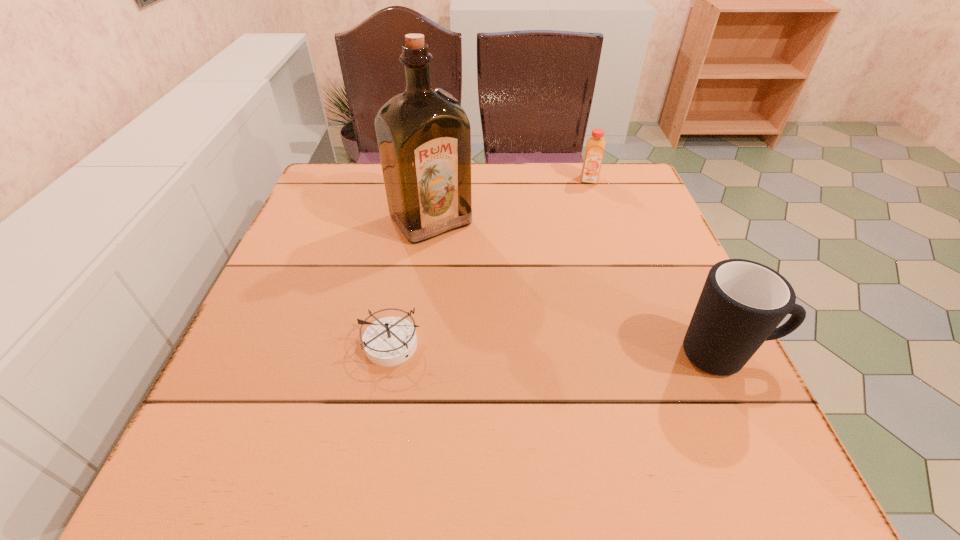
Image resolution: width=960 pixels, height=540 pixels. I want to click on vacant region located on the label of the liquor, so click(x=460, y=254).

Identify the location of vacant space situated 0.090m on the front and back of the farthest object. (590, 204).

In order to click on vacant region located on the front and back of the farthest object in this screenshot , I will do `click(593, 243)`.

This screenshot has height=540, width=960. I want to click on vacant area situated 0.050m on the front and back of the farthest object, so click(x=590, y=195).

This screenshot has width=960, height=540. Identify the location of liquor at the far edge. (424, 137).

At what (x,y) coordinates should I click in order to perform the action: click on orange juice at the far edge. Please return your answer as a coordinate pair (x, y). Looking at the image, I should click on (595, 145).

This screenshot has width=960, height=540. What are the coordinates of `object that is at the near edge` in the screenshot? It's located at (742, 302).

This screenshot has height=540, width=960. What are the coordinates of `mug positioned at the right edge` in the screenshot? It's located at (742, 302).

Locate an element on the screen. Image resolution: width=960 pixels, height=540 pixels. orange juice that is at the right edge is located at coordinates (595, 145).

This screenshot has height=540, width=960. What are the coordinates of `object at the far right corner` in the screenshot? It's located at (595, 145).